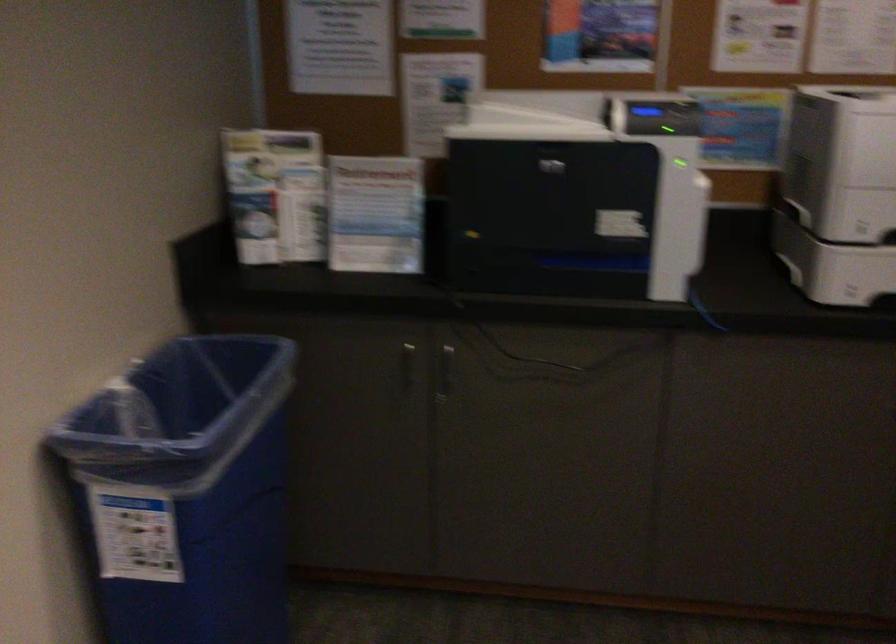
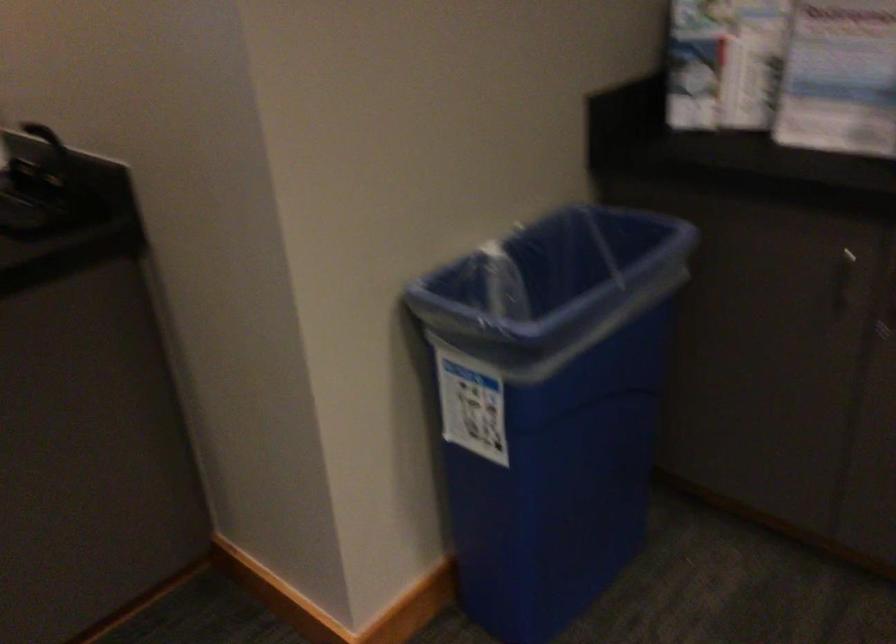
In the second image, find the point that corresponds to pixel 376 219 in the first image.

(840, 79)